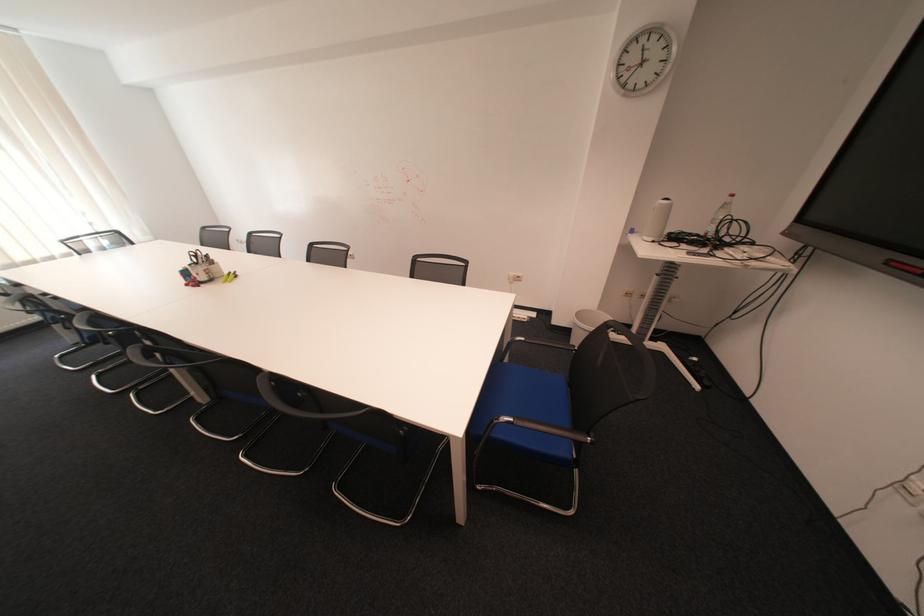
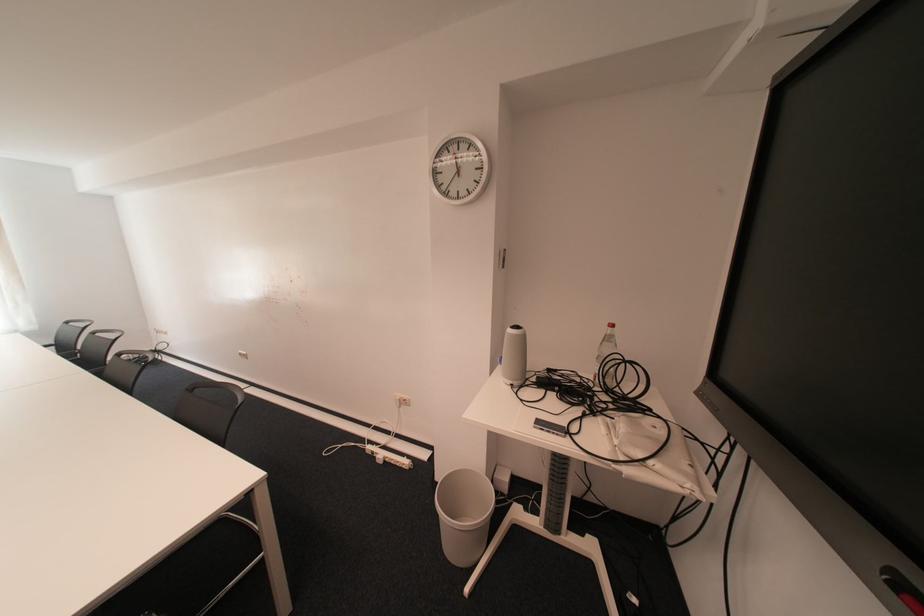
Where in the second image is the point corresponding to point 636,86 from the first image?

(457, 195)